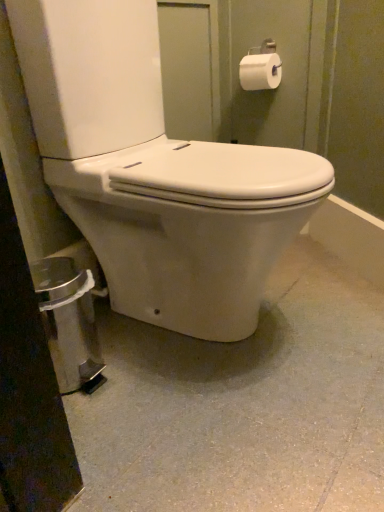
Image resolution: width=384 pixels, height=512 pixels. In order to click on free space above white smooth concrete at center (from a real-world perspective) in this screenshot , I will do `click(228, 365)`.